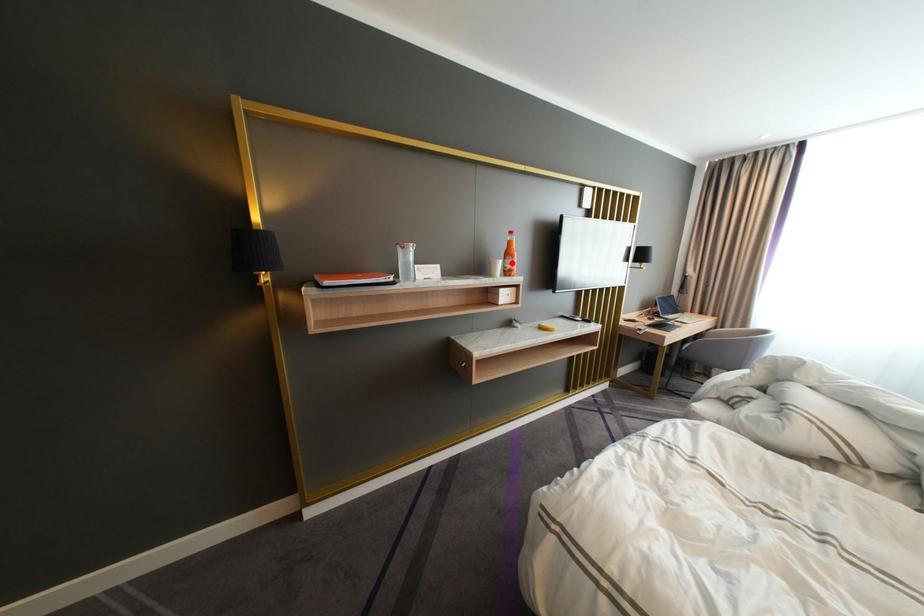
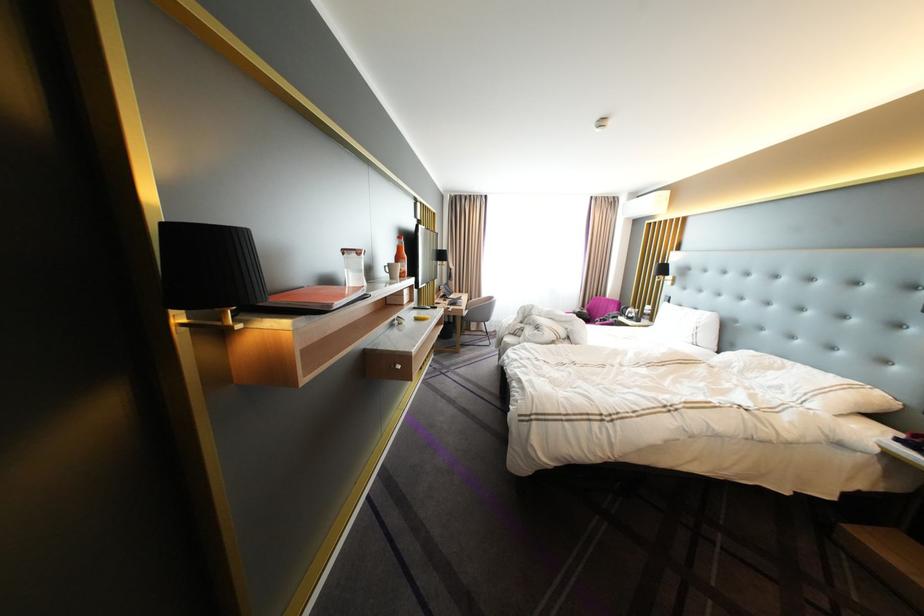
In the second image, find the point that corresponds to the highlighted location in the first image.

(411, 265)